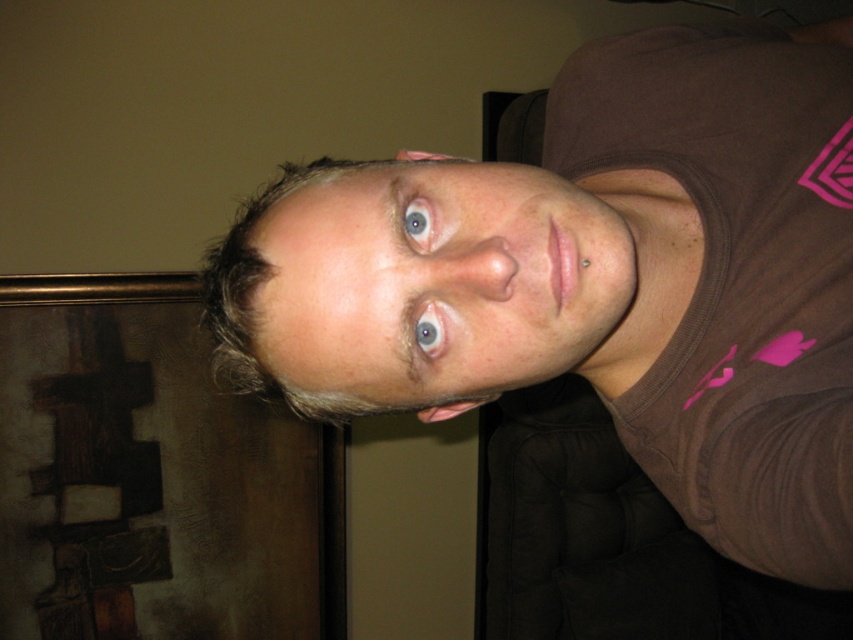
Who is higher up, blue matte eye at upper center or blue matte eye at center?

blue matte eye at upper center

The image size is (853, 640). Identify the location of blue matte eye at upper center. pyautogui.click(x=419, y=221).

Which is behind, point (500, 330) or point (422, 230)?

The point (422, 230) is behind.

You are a GUI agent. You are given a task and a screenshot of the screen. Output one action in this format:
    pyautogui.click(x=<x>, y=<y>)
    Task: Click on the pale skin at center
    The height and width of the screenshot is (640, 853).
    Given the screenshot: What is the action you would take?
    pyautogui.click(x=440, y=288)

Who is more distant from viewer, (318, 278) or (434, 332)?

The point (434, 332) is behind.

The image size is (853, 640). What do you see at coordinates (602, 282) in the screenshot?
I see `brown cotton shirt at upper center` at bounding box center [602, 282].

This screenshot has height=640, width=853. In order to click on brown cotton shirt at upper center in this screenshot , I will do `click(602, 282)`.